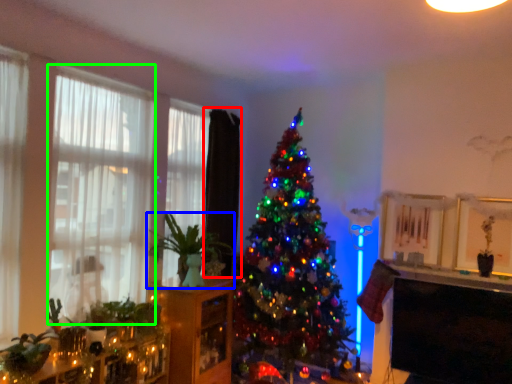
Question: Which object is the farthest from curtain (highlighted by a red box)? Choose among these: houseplant (highlighted by a blue box) or window (highlighted by a green box).

Choices:
 (A) houseplant
 (B) window

Answer: (B)